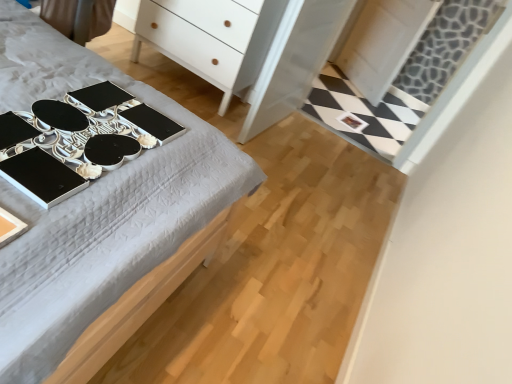
Question: Is metallic silver changing table at upper left smaller than black glossy desk at upper left?

Choices:
 (A) no
 (B) yes

Answer: (B)

Question: Can you confirm if metallic silver changing table at upper left is positioned to the left of black glossy desk at upper left?

Choices:
 (A) no
 (B) yes

Answer: (A)

Question: From a real-world perspective, is metallic silver changing table at upper left on top of black glossy desk at upper left?

Choices:
 (A) yes
 (B) no

Answer: (A)

Question: Does metallic silver changing table at upper left have a lesser width compared to black glossy desk at upper left?

Choices:
 (A) yes
 (B) no

Answer: (A)

Question: Is metallic silver changing table at upper left positioned behind black glossy desk at upper left?

Choices:
 (A) yes
 (B) no

Answer: (B)

Question: Looking at their shapes, would you say white glossy dresser at center is wider or thinner than white matte chest of drawers at upper center?

Choices:
 (A) wide
 (B) thin

Answer: (B)

Question: Is white glossy dresser at center inside the boundaries of white matte chest of drawers at upper center, or outside?

Choices:
 (A) inside
 (B) outside

Answer: (B)

Question: In the image, is white glossy dresser at center on the left side or the right side of white matte chest of drawers at upper center?

Choices:
 (A) left
 (B) right

Answer: (B)

Question: In the image, is white glossy dresser at center positioned in front of or behind white matte chest of drawers at upper center?

Choices:
 (A) behind
 (B) front

Answer: (B)

Question: Choose the correct answer: Is white matte chest of drawers at upper center inside black glossy desk at upper left or outside it?

Choices:
 (A) outside
 (B) inside

Answer: (A)

Question: Would you say white matte chest of drawers at upper center is to the left or to the right of black glossy desk at upper left in the picture?

Choices:
 (A) left
 (B) right

Answer: (B)

Question: Based on their sizes in the image, would you say white matte chest of drawers at upper center is bigger or smaller than black glossy desk at upper left?

Choices:
 (A) big
 (B) small

Answer: (A)

Question: Considering their positions, is white matte chest of drawers at upper center located in front of or behind black glossy desk at upper left?

Choices:
 (A) behind
 (B) front

Answer: (A)

Question: Do you think black glossy desk at upper left is within metallic silver changing table at upper left, or outside of it?

Choices:
 (A) inside
 (B) outside

Answer: (B)

Question: Is black glossy desk at upper left to the left or to the right of metallic silver changing table at upper left in the image?

Choices:
 (A) right
 (B) left

Answer: (B)